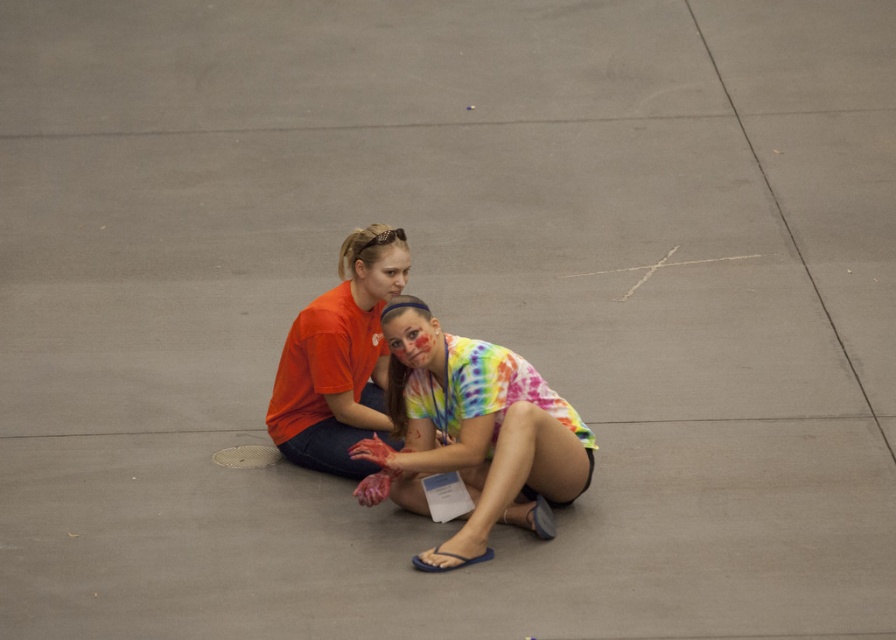
Question: Is tie-dye fabric shirt at center bigger than matte orange t-shirt at center?

Choices:
 (A) yes
 (B) no

Answer: (A)

Question: Which point appears closest to the camera in this image?

Choices:
 (A) (412, 358)
 (B) (289, 416)

Answer: (A)

Question: Which object is farther from the camera taking this photo?

Choices:
 (A) tie-dye fabric shirt at center
 (B) matte orange t-shirt at center

Answer: (B)

Question: Is tie-dye fabric shirt at center closer to the viewer compared to matte orange t-shirt at center?

Choices:
 (A) yes
 (B) no

Answer: (A)

Question: Observing the image, what is the correct spatial positioning of tie-dye fabric shirt at center in reference to matte orange t-shirt at center?

Choices:
 (A) right
 (B) left

Answer: (A)

Question: Which object appears farthest from the camera in this image?

Choices:
 (A) matte orange t-shirt at center
 (B) tie-dye fabric shirt at center

Answer: (A)